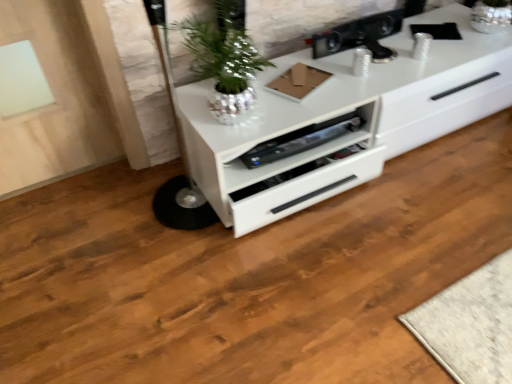
This screenshot has width=512, height=384. I want to click on metallic black speaker at upper center, the second appliance when ordered from bottom to top, so click(359, 36).

Measure the distance between point [330,43] and camera.

A distance of 5.62 feet exists between point [330,43] and camera.

Measure the distance between point (283, 150) and camera.

A distance of 1.40 meters exists between point (283, 150) and camera.

Where is `metallic black speaker at upper center, the second appliance when ordered from bottom to top`? metallic black speaker at upper center, the second appliance when ordered from bottom to top is located at coordinates (359, 36).

Does shiny metallic plant at center have a greater height compared to satin black speaker at center, which ranks as the 2th appliance in top-to-bottom order?

Indeed, shiny metallic plant at center has a greater height compared to satin black speaker at center, which ranks as the 2th appliance in top-to-bottom order.

Which of these two, shiny metallic plant at center or satin black speaker at center, which ranks as the 2th appliance in top-to-bottom order, is smaller?

With smaller size is satin black speaker at center, which ranks as the 2th appliance in top-to-bottom order.

Is shiny metallic plant at center inside or outside of satin black speaker at center, the 1th appliance ordered from the bottom?

shiny metallic plant at center is outside satin black speaker at center, the 1th appliance ordered from the bottom.

Can you tell me how much shiny metallic plant at center and satin black speaker at center, the 1th appliance ordered from the bottom, differ in facing direction?

0.000381 degrees.

What's the angular difference between white glossy chest of drawers at center and shiny metallic plant at center's facing directions?

The angle between the facing direction of white glossy chest of drawers at center and the facing direction of shiny metallic plant at center is 0.345 degrees.

From the image's perspective, is white glossy chest of drawers at center above shiny metallic plant at center?

No, from the image's perspective, white glossy chest of drawers at center is not above shiny metallic plant at center.

How much distance is there between white glossy chest of drawers at center and shiny metallic plant at center?

white glossy chest of drawers at center and shiny metallic plant at center are 12.30 inches apart.

Does point (264, 117) appear closer or farther from the camera than point (222, 78)?

Point (264, 117).

Is satin black speaker at center, the 1th appliance ordered from the bottom, inside the boundaries of shiny metallic plant at center, or outside?

satin black speaker at center, the 1th appliance ordered from the bottom, is not inside shiny metallic plant at center, it's outside.

Could you tell me if satin black speaker at center, which ranks as the 2th appliance in top-to-bottom order, is facing shiny metallic plant at center?

No, satin black speaker at center, which ranks as the 2th appliance in top-to-bottom order, does not turn towards shiny metallic plant at center.

Which of these two, satin black speaker at center, the 1th appliance ordered from the bottom, or shiny metallic plant at center, is wider?

shiny metallic plant at center is wider.

What are the coordinates of `chest of drawers that appears on the right of metallic black speaker at upper center, arranged as the first appliance when viewed from the top` in the screenshot? It's located at (344, 113).

Considering the sizes of objects white glossy chest of drawers at center and metallic black speaker at upper center, arranged as the first appliance when viewed from the top, in the image provided, who is bigger, white glossy chest of drawers at center or metallic black speaker at upper center, arranged as the first appliance when viewed from the top,?

With larger size is white glossy chest of drawers at center.

Would you say white glossy chest of drawers at center contains metallic black speaker at upper center, the second appliance when ordered from bottom to top?

No, white glossy chest of drawers at center does not contain metallic black speaker at upper center, the second appliance when ordered from bottom to top.

Does white glossy chest of drawers at center touch metallic black speaker at upper center, the second appliance when ordered from bottom to top?

They are not placed beside each other.

Consider the image. From a real-world perspective, which is physically below, metallic black speaker at upper center, the second appliance when ordered from bottom to top, or white glossy chest of drawers at center?

white glossy chest of drawers at center.

Is metallic black speaker at upper center, arranged as the first appliance when viewed from the top, bigger than white glossy chest of drawers at center?

Incorrect, metallic black speaker at upper center, arranged as the first appliance when viewed from the top, is not larger than white glossy chest of drawers at center.

Considering the relative sizes of metallic black speaker at upper center, arranged as the first appliance when viewed from the top, and white glossy chest of drawers at center in the image provided, is metallic black speaker at upper center, arranged as the first appliance when viewed from the top, thinner than white glossy chest of drawers at center?

Yes, metallic black speaker at upper center, arranged as the first appliance when viewed from the top, is thinner than white glossy chest of drawers at center.

Is white glossy chest of drawers at center wider or thinner than satin black speaker at center, which ranks as the 2th appliance in top-to-bottom order?

Clearly, white glossy chest of drawers at center has more width compared to satin black speaker at center, which ranks as the 2th appliance in top-to-bottom order.

From the white glossy chest of drawers at center, count the 2nd appliance to the left and point to it. Please provide its 2D coordinates.

[(301, 140)]

Is point (286, 184) closer or farther from the camera than point (298, 152)?

Clearly, point (286, 184) is closer to the camera than point (298, 152).

Could satin black speaker at center, the 1th appliance ordered from the bottom, be considered to be inside white glossy chest of drawers at center?

Yes, satin black speaker at center, the 1th appliance ordered from the bottom, is surrounded by white glossy chest of drawers at center.

Is the position of metallic black speaker at upper center, arranged as the first appliance when viewed from the top, less distant than that of shiny metallic plant at center?

No, the depth of metallic black speaker at upper center, arranged as the first appliance when viewed from the top, is greater than that of shiny metallic plant at center.

From a real-world perspective, relative to shiny metallic plant at center, is metallic black speaker at upper center, the second appliance when ordered from bottom to top, vertically above or below?

Clearly, from a real-world perspective, metallic black speaker at upper center, the second appliance when ordered from bottom to top, is below shiny metallic plant at center.

Does point (372, 49) come closer to viewer compared to point (236, 53)?

No, (372, 49) is further to viewer.

Is metallic black speaker at upper center, the second appliance when ordered from bottom to top, far away from shiny metallic plant at center?

metallic black speaker at upper center, the second appliance when ordered from bottom to top, is near shiny metallic plant at center, not far away.

There is a satin black speaker at center, which ranks as the 2th appliance in top-to-bottom order. At what (x,y) coordinates should I click in order to perform the action: click on houseplant above it (from a real-world perspective). Please return your answer as a coordinate pair (x, y). The image size is (512, 384). Looking at the image, I should click on (224, 59).

At what (x,y) coordinates should I click in order to perform the action: click on houseplant above the white glossy chest of drawers at center (from the image's perspective). Please return your answer as a coordinate pair (x, y). The width and height of the screenshot is (512, 384). Looking at the image, I should click on pyautogui.click(x=224, y=59).

Based on their spatial positions, is white glossy chest of drawers at center or metallic black speaker at upper center, the second appliance when ordered from bottom to top, further from satin black speaker at center, which ranks as the 2th appliance in top-to-bottom order?

The object further to satin black speaker at center, which ranks as the 2th appliance in top-to-bottom order, is metallic black speaker at upper center, the second appliance when ordered from bottom to top.

Based on their spatial positions, is satin black speaker at center, the 1th appliance ordered from the bottom, or white glossy chest of drawers at center further from shiny metallic plant at center?

white glossy chest of drawers at center is positioned further to the anchor shiny metallic plant at center.

Based on their spatial positions, is satin black speaker at center, which ranks as the 2th appliance in top-to-bottom order, or metallic black speaker at upper center, the second appliance when ordered from bottom to top, closer to shiny metallic plant at center?

satin black speaker at center, which ranks as the 2th appliance in top-to-bottom order.

Based on their spatial positions, is shiny metallic plant at center or metallic black speaker at upper center, the second appliance when ordered from bottom to top, further from white glossy chest of drawers at center?

shiny metallic plant at center is positioned further to the anchor white glossy chest of drawers at center.

From the image, which object appears to be nearer to white glossy chest of drawers at center, satin black speaker at center, which ranks as the 2th appliance in top-to-bottom order, or shiny metallic plant at center?

satin black speaker at center, which ranks as the 2th appliance in top-to-bottom order, lies closer to white glossy chest of drawers at center than the other object.

Looking at the image, which one is located closer to white glossy chest of drawers at center, satin black speaker at center, which ranks as the 2th appliance in top-to-bottom order, or metallic black speaker at upper center, arranged as the first appliance when viewed from the top?

The object closer to white glossy chest of drawers at center is satin black speaker at center, which ranks as the 2th appliance in top-to-bottom order.

When comparing their distances from white glossy chest of drawers at center, does metallic black speaker at upper center, the second appliance when ordered from bottom to top, or shiny metallic plant at center seem closer?

The object closer to white glossy chest of drawers at center is metallic black speaker at upper center, the second appliance when ordered from bottom to top.

Based on their spatial positions, is white glossy chest of drawers at center or satin black speaker at center, which ranks as the 2th appliance in top-to-bottom order, further from metallic black speaker at upper center, the second appliance when ordered from bottom to top?

satin black speaker at center, which ranks as the 2th appliance in top-to-bottom order.

At what (x,y) coordinates should I click in order to perform the action: click on chest of drawers between metallic black speaker at upper center, arranged as the first appliance when viewed from the top, and satin black speaker at center, which ranks as the 2th appliance in top-to-bottom order, in the up-down direction. Please return your answer as a coordinate pair (x, y). The width and height of the screenshot is (512, 384). Looking at the image, I should click on (344, 113).

Locate an element on the screen. Image resolution: width=512 pixels, height=384 pixels. appliance between shiny metallic plant at center and metallic black speaker at upper center, arranged as the first appliance when viewed from the top, along the z-axis is located at coordinates (301, 140).